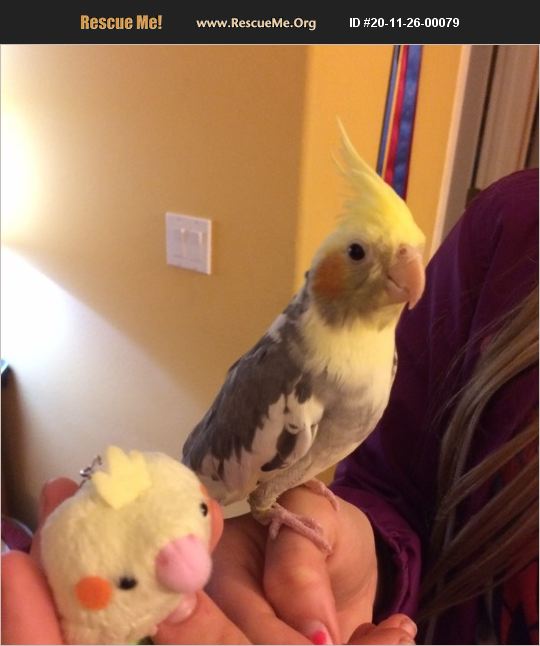
Where is `wall`? The image size is (540, 646). wall is located at coordinates (107, 242).